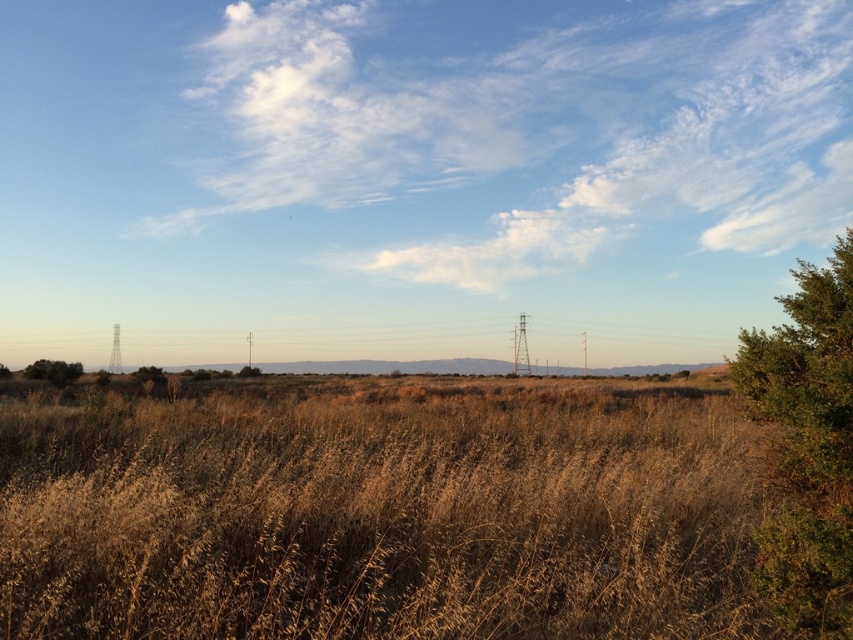
I want to click on brown dry grass at center, so click(378, 508).

Between brown dry grass at center and green leafy bush at lower left, which one appears on the left side from the viewer's perspective?

green leafy bush at lower left

Does point (399, 616) lie behind point (51, 378)?

No.

You are a GUI agent. You are given a task and a screenshot of the screen. Output one action in this format:
    pyautogui.click(x=<x>, y=<y>)
    Task: Click on the brown dry grass at center
    
    Given the screenshot: What is the action you would take?
    pyautogui.click(x=378, y=508)

Can you confirm if green leafy tree at right is wider than green leafy bush at lower left?

Incorrect, green leafy tree at right's width does not surpass green leafy bush at lower left's.

How far apart are green leafy tree at right and green leafy bush at lower left?

A distance of 59.25 meters exists between green leafy tree at right and green leafy bush at lower left.

I want to click on green leafy tree at right, so click(x=807, y=444).

Find the location of a particular element. Image resolution: width=853 pixels, height=640 pixels. green leafy tree at right is located at coordinates (807, 444).

Which of these two, brown dry grass at center or green leafy tree at right, stands shorter?

Standing shorter between the two is brown dry grass at center.

Locate an element on the screen. brown dry grass at center is located at coordinates (378, 508).

Locate an element on the screen. The width and height of the screenshot is (853, 640). brown dry grass at center is located at coordinates (378, 508).